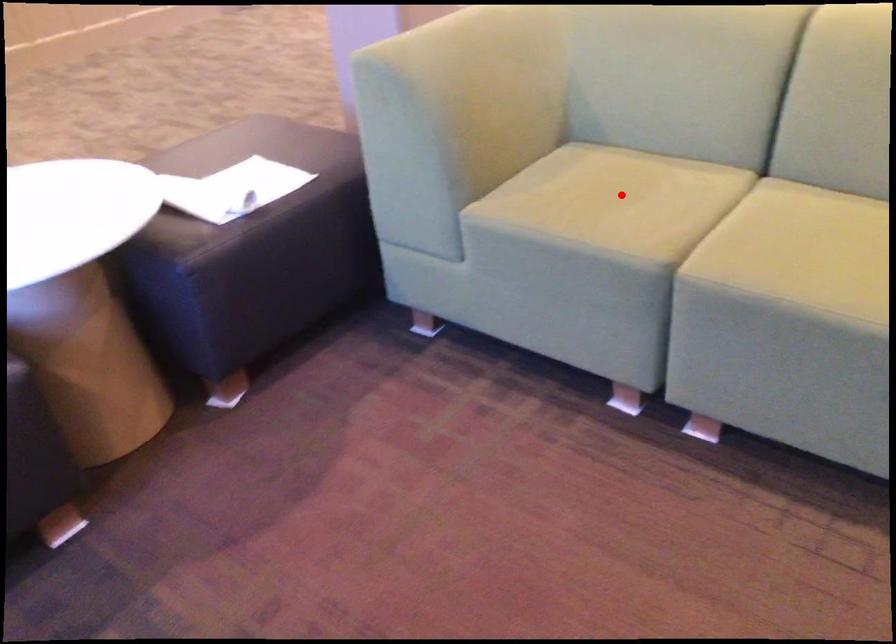
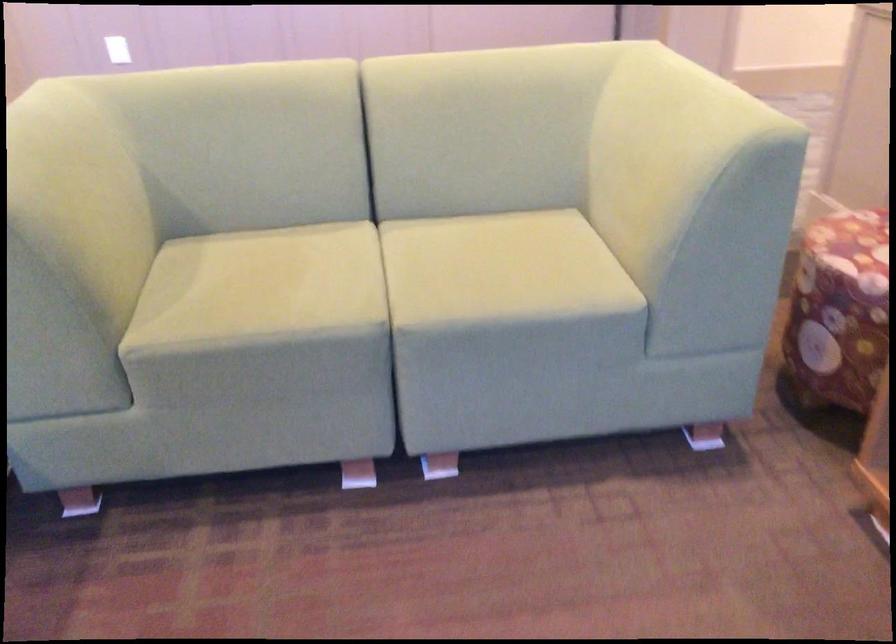
In the second image, find the point that corresponds to the highlighted location in the first image.

(280, 277)